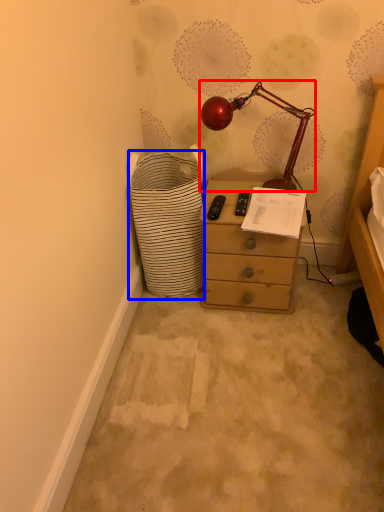
Question: Which object appears farthest to the camera in this image, lamp (highlighted by a red box) or shopping basket (highlighted by a blue box)?

Choices:
 (A) lamp
 (B) shopping basket

Answer: (A)